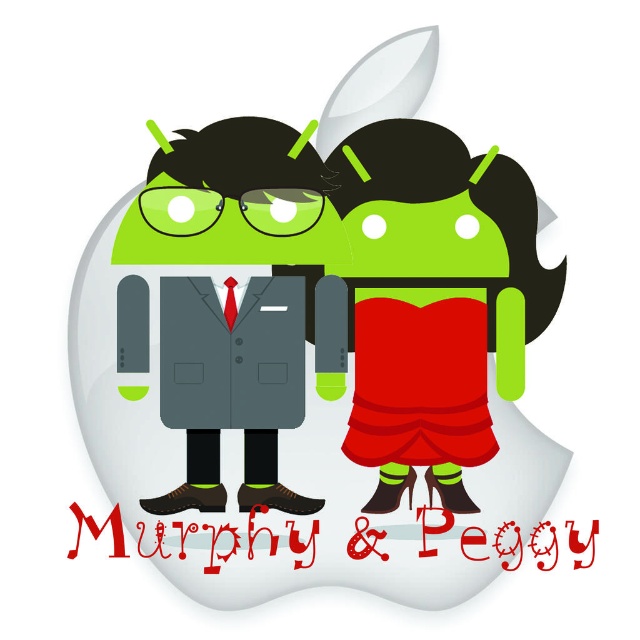
Question: Can you confirm if matte black suit at center is positioned to the left of matte gray suit at center?

Choices:
 (A) yes
 (B) no

Answer: (B)

Question: Which point is closer to the camera?

Choices:
 (A) matte gray suit at center
 (B) matte black suit at center

Answer: (A)

Question: Which point appears closest to the camera in this image?

Choices:
 (A) (212, 480)
 (B) (269, 508)

Answer: (A)

Question: Does matte black suit at center have a smaller size compared to matte gray suit at center?

Choices:
 (A) no
 (B) yes

Answer: (A)

Question: Is matte black suit at center closer to the viewer compared to matte gray suit at center?

Choices:
 (A) yes
 (B) no

Answer: (B)

Question: Which point is farther from the camera taking this photo?

Choices:
 (A) (188, 312)
 (B) (483, 516)

Answer: (A)